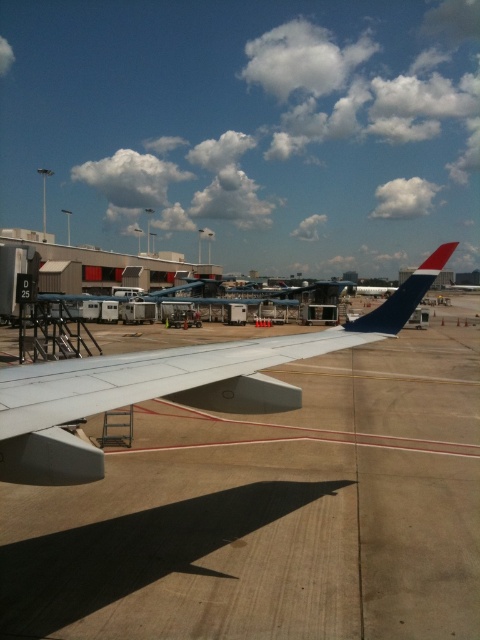
Question: Considering the real-world distances, which object is closest to the matte white wing at center?

Choices:
 (A) concrete tarmac at center
 (B) blue matte tail fin at upper right

Answer: (B)

Question: Can you confirm if concrete tarmac at center is positioned to the right of blue matte tail fin at upper right?

Choices:
 (A) no
 (B) yes

Answer: (A)

Question: Which of the following is the closest to the observer?

Choices:
 (A) click(x=425, y=259)
 (B) click(x=462, y=611)
 (C) click(x=168, y=372)

Answer: (C)

Question: Does concrete tarmac at center appear on the left side of matte white wing at center?

Choices:
 (A) no
 (B) yes

Answer: (A)

Question: Is concrete tarmac at center in front of matte white wing at center?

Choices:
 (A) yes
 (B) no

Answer: (B)

Question: Which object is the closest to the blue matte tail fin at upper right?

Choices:
 (A) matte white wing at center
 (B) concrete tarmac at center

Answer: (A)